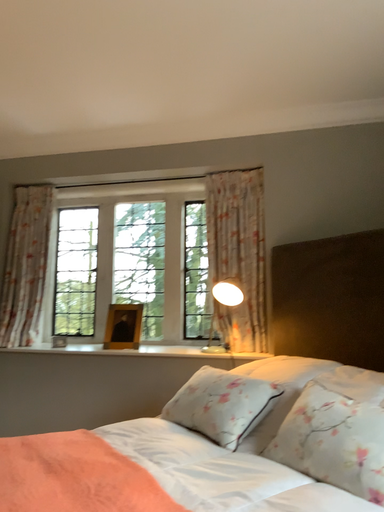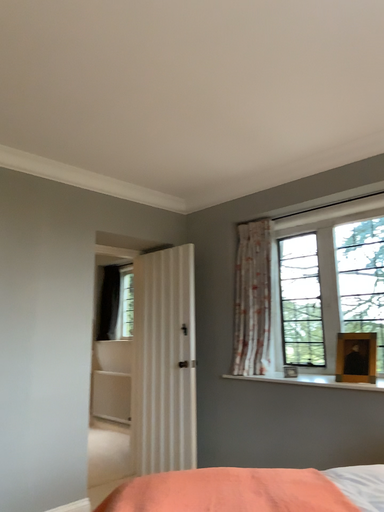
Question: Which way did the camera rotate in the video?

Choices:
 (A) rotated right
 (B) rotated left

Answer: (B)